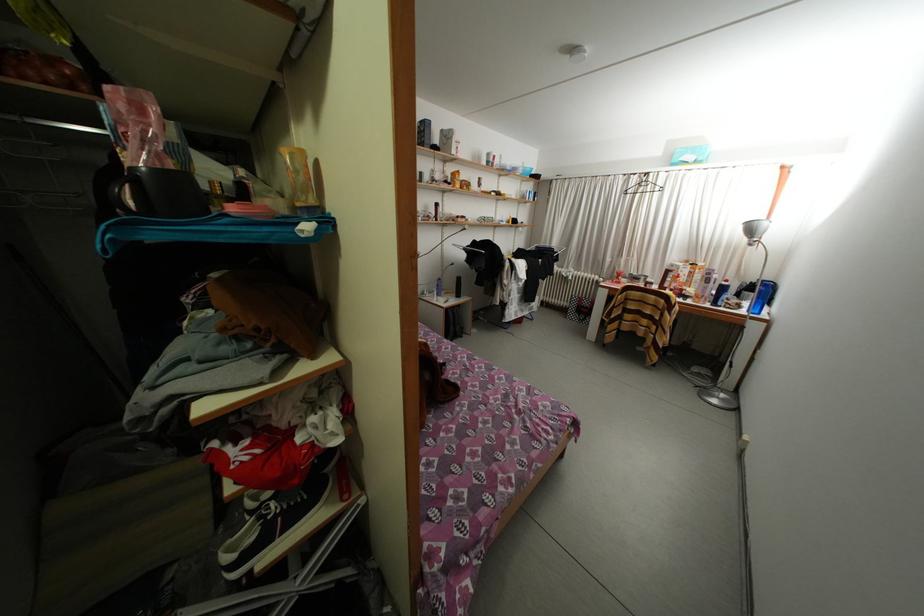
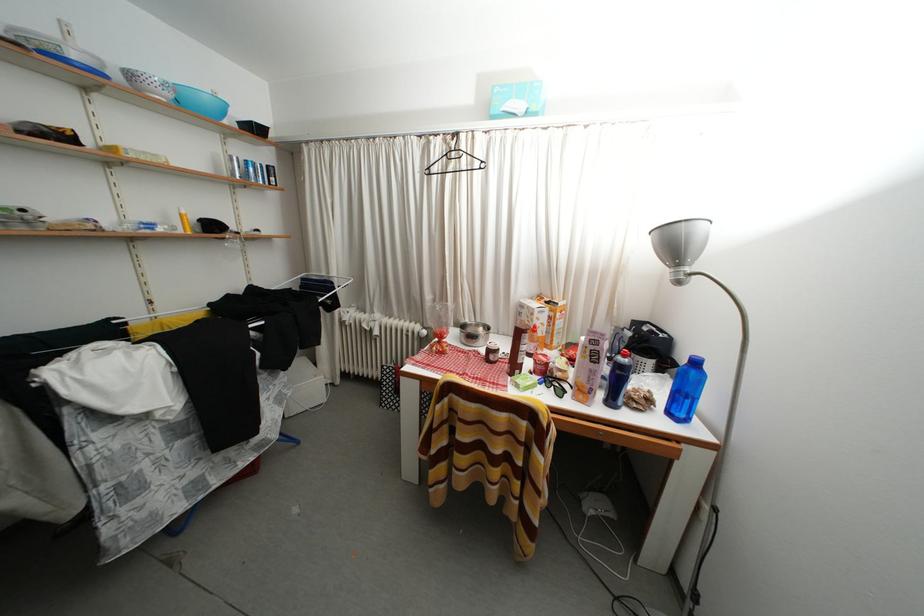
In the second image, find the point that corresponds to the point at 516,172 in the first image.

(81, 61)